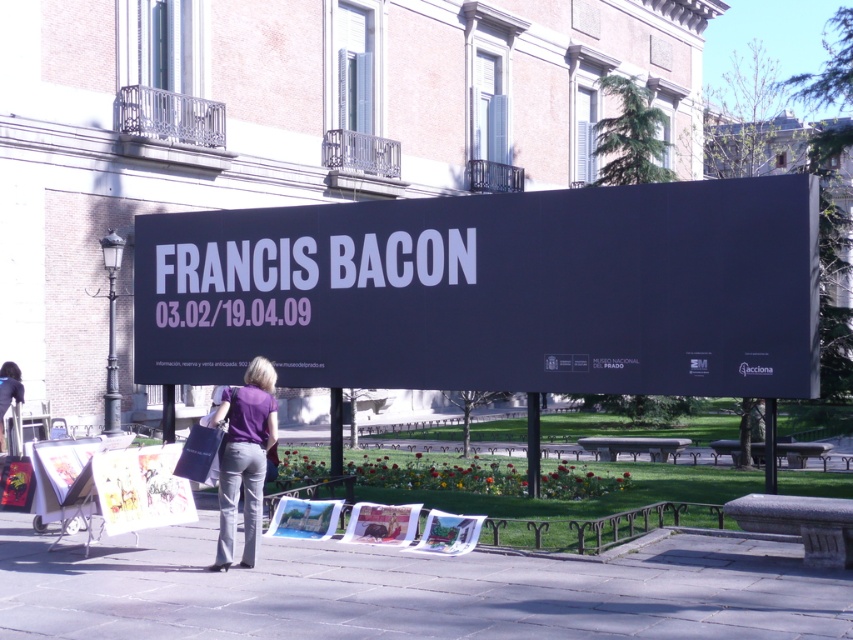
Who is shorter, black matte sign at center or matte paper posters at lower left?

black matte sign at center is shorter.

Is black matte sign at center to the left of matte paper posters at lower left from the viewer's perspective?

In fact, black matte sign at center is to the right of matte paper posters at lower left.

Describe the element at coordinates (492, 291) in the screenshot. This screenshot has width=853, height=640. I see `black matte sign at center` at that location.

Locate an element on the screen. The height and width of the screenshot is (640, 853). black matte sign at center is located at coordinates (492, 291).

Which of these two, smooth concrete pavement at lower center or matte paper posters at lower left, stands taller?

With more height is matte paper posters at lower left.

Does smooth concrete pavement at lower center have a greater width compared to matte paper posters at lower left?

Incorrect, smooth concrete pavement at lower center's width does not surpass matte paper posters at lower left's.

The image size is (853, 640). Identify the location of smooth concrete pavement at lower center. (409, 589).

Is smooth concrete pavement at lower center taller than matte black bag at lower left?

In fact, smooth concrete pavement at lower center may be shorter than matte black bag at lower left.

Can you confirm if smooth concrete pavement at lower center is positioned to the right of matte black bag at lower left?

Correct, you'll find smooth concrete pavement at lower center to the right of matte black bag at lower left.

Describe the element at coordinates (409, 589) in the screenshot. I see `smooth concrete pavement at lower center` at that location.

The width and height of the screenshot is (853, 640). What are the coordinates of `smooth concrete pavement at lower center` in the screenshot? It's located at (409, 589).